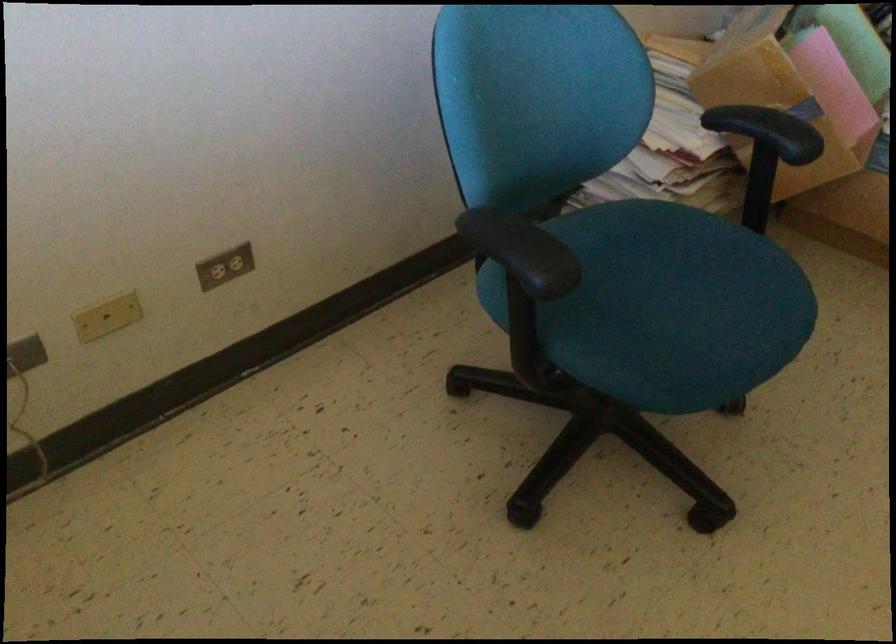
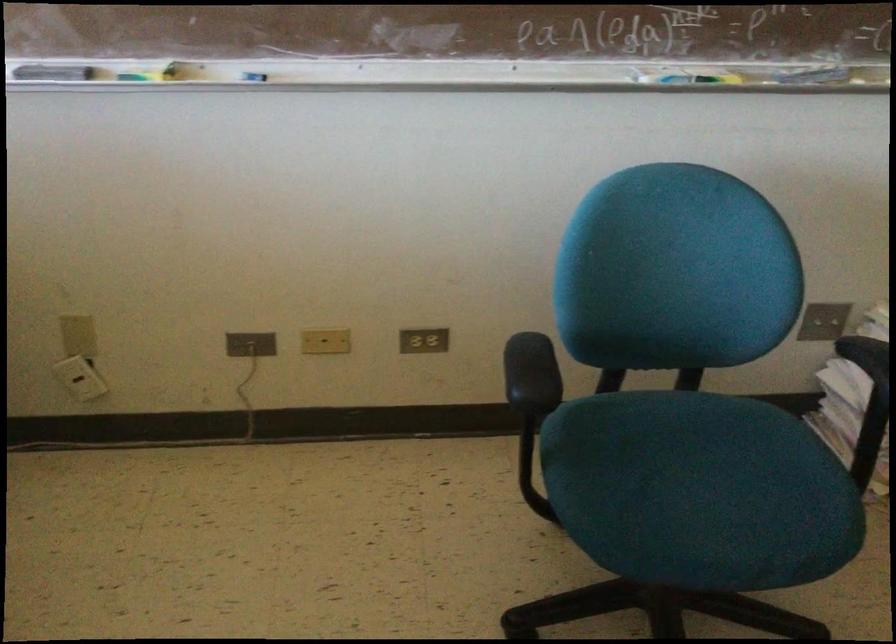
Where in the second image is the point corresponding to pixel 116 319 from the first image?

(325, 341)